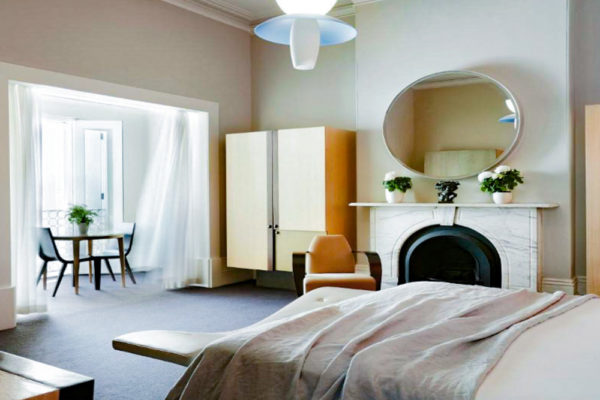
This screenshot has height=400, width=600. I want to click on plant, so click(78, 224).